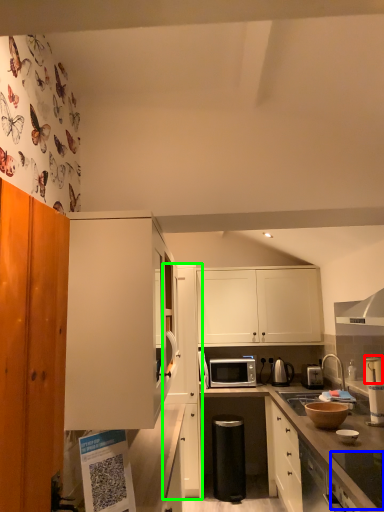
Question: Which is farther away from appliance (highlighted by a red box)? appliance (highlighted by a blue box) or cabinetry (highlighted by a green box)?

Choices:
 (A) appliance
 (B) cabinetry

Answer: (B)